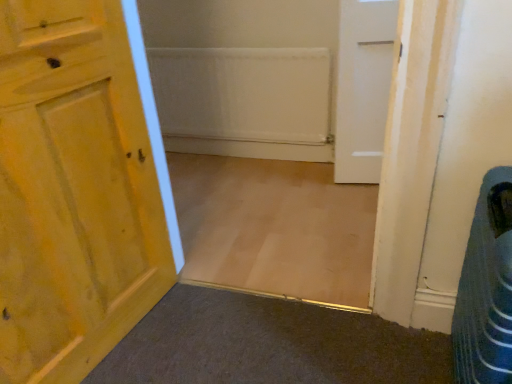
Question: Is blue striped fabric laundry basket at lower right wider than white matte door at upper right, which is the second door in front-to-back order?

Choices:
 (A) yes
 (B) no

Answer: (A)

Question: From the image's perspective, is blue striped fabric laundry basket at lower right below white matte door at upper right, positioned as the 2th door in left-to-right order?

Choices:
 (A) yes
 (B) no

Answer: (A)

Question: Is blue striped fabric laundry basket at lower right not near white matte door at upper right, the 1th door viewed from the right?

Choices:
 (A) yes
 (B) no

Answer: (A)

Question: Is blue striped fabric laundry basket at lower right outside of white matte door at upper right, positioned as the 1th door in back-to-front order?

Choices:
 (A) yes
 (B) no

Answer: (A)

Question: Is blue striped fabric laundry basket at lower right further to the viewer compared to white matte door at upper right, positioned as the 2th door in left-to-right order?

Choices:
 (A) yes
 (B) no

Answer: (B)

Question: Is blue striped fabric laundry basket at lower right bigger than white matte door at upper right, positioned as the 2th door in left-to-right order?

Choices:
 (A) yes
 (B) no

Answer: (A)

Question: Is white matte door at upper right, the 1th door viewed from the right, behind wooden door at left, which is the 2th door in right-to-left order?

Choices:
 (A) no
 (B) yes

Answer: (B)

Question: From a real-world perspective, does white matte door at upper right, positioned as the 1th door in back-to-front order, sit lower than wooden door at left, positioned as the first door in front-to-back order?

Choices:
 (A) no
 (B) yes

Answer: (B)

Question: Is white matte door at upper right, positioned as the 1th door in back-to-front order, turned away from wooden door at left, which is counted as the 1th door, starting from the left?

Choices:
 (A) yes
 (B) no

Answer: (B)

Question: Is white matte door at upper right, which is the second door in front-to-back order, facing towards wooden door at left, which is the 2th door in right-to-left order?

Choices:
 (A) no
 (B) yes

Answer: (A)

Question: Considering the relative positions of white matte door at upper right, which is the second door in front-to-back order, and wooden door at left, the 2th door in the back-to-front sequence, in the image provided, is white matte door at upper right, which is the second door in front-to-back order, to the right of wooden door at left, the 2th door in the back-to-front sequence, from the viewer's perspective?

Choices:
 (A) yes
 (B) no

Answer: (A)

Question: Is white matte door at upper right, the 1th door viewed from the right, surrounding wooden door at left, the 2th door in the back-to-front sequence?

Choices:
 (A) no
 (B) yes

Answer: (A)

Question: Does white matte door at upper right, the 1th door viewed from the right, touch blue striped fabric laundry basket at lower right?

Choices:
 (A) no
 (B) yes

Answer: (A)